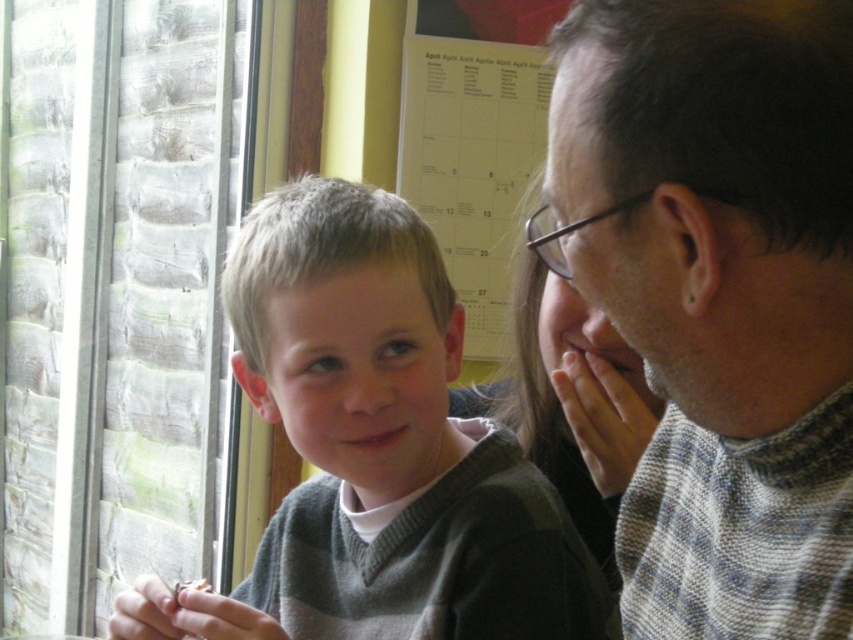
You are a photographer standing 30 inches away from the scene. You want to take a closeup shot of the point at coordinates point (376, 406). Is your current distance sufficient to capture the point clearly?

The distance of point (376, 406) from viewer is 33.67 inches. Since you are standing 30 inches away, you are closer than the required distance. Move back to ensure the point is in focus.

You are a photographer setting up a shoot in this room. You need to place a small prop between the gray knitted sweater at right and the white paper calendar at upper center. Based on their positions, where should you place the prop so it is equidistant from both objects?

The gray knitted sweater at right is below the white paper calendar at upper center, so placing the prop halfway between them vertically would ensure it is equidistant from both objects.